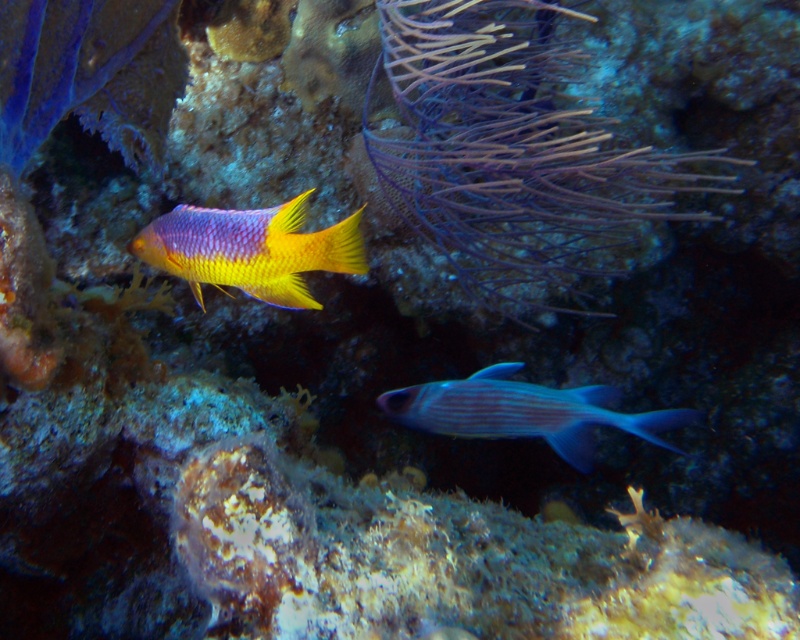
Between point (136, 248) and point (466, 404), which one is positioned behind?

The point (466, 404) is behind.

Does shiny yellow fish at center have a lesser width compared to purple glossy fish at lower center?

Indeed, shiny yellow fish at center has a lesser width compared to purple glossy fish at lower center.

Find the location of a particular element. Image resolution: width=800 pixels, height=640 pixels. shiny yellow fish at center is located at coordinates (250, 250).

Where is `shiny yellow fish at center`? The width and height of the screenshot is (800, 640). shiny yellow fish at center is located at coordinates (250, 250).

Can you confirm if purple soft coral at upper center is positioned to the left of shiny yellow fish at center?

In fact, purple soft coral at upper center is to the right of shiny yellow fish at center.

Which is in front, point (478, 240) or point (156, 264)?

Point (156, 264)

Between point (552, 177) and point (280, 221), which one is positioned behind?

Point (552, 177)

Locate an element on the screen. This screenshot has height=640, width=800. purple soft coral at upper center is located at coordinates (510, 145).

Does purple soft coral at upper center lie behind purple glossy fish at lower center?

No, purple soft coral at upper center is closer to the viewer.

Which is below, purple soft coral at upper center or purple glossy fish at lower center?

Positioned lower is purple glossy fish at lower center.

Where is `purple soft coral at upper center`? purple soft coral at upper center is located at coordinates (510, 145).

This screenshot has width=800, height=640. Identify the location of purple soft coral at upper center. (510, 145).